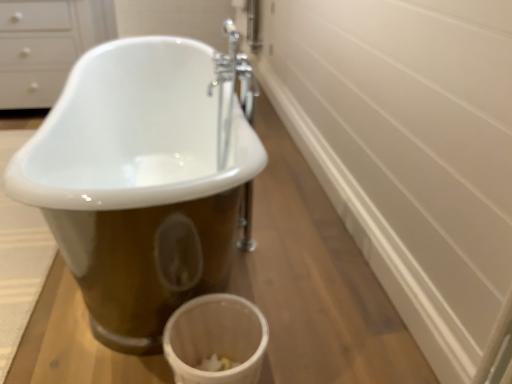
The height and width of the screenshot is (384, 512). Identify the location of empty space that is to the right of white matte toilet bowl at lower center. (314, 354).